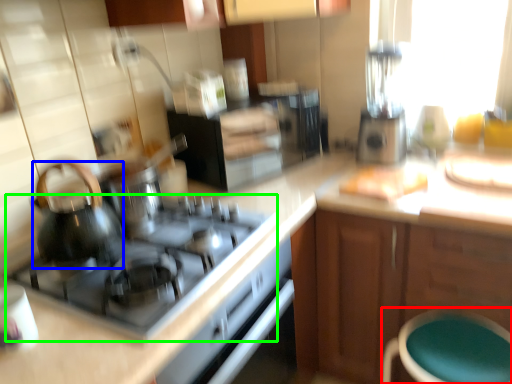
Question: Based on their relative distances, which object is farther from bar stool (highlighted by a red box)? Choose from kitchen appliance (highlighted by a blue box) and gas stove (highlighted by a green box).

Choices:
 (A) kitchen appliance
 (B) gas stove

Answer: (A)